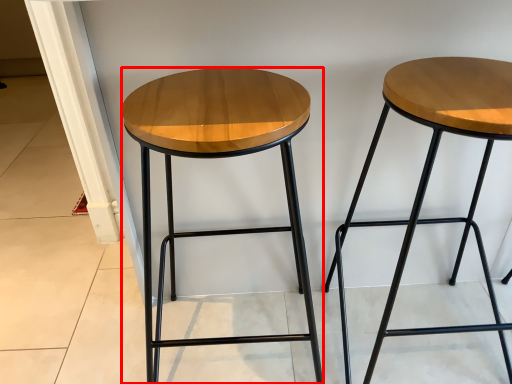
Question: From the image, what is the correct spatial relationship of stool (annotated by the red box) in relation to stool?

Choices:
 (A) left
 (B) right

Answer: (A)